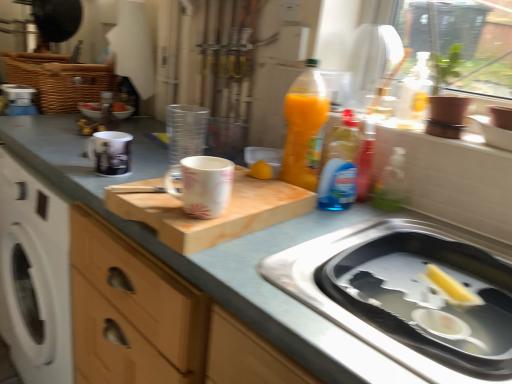
Identify the location of free space in front of translucent plastic bottle at upper center, which is the second bottle from top to bottom. (358, 211).